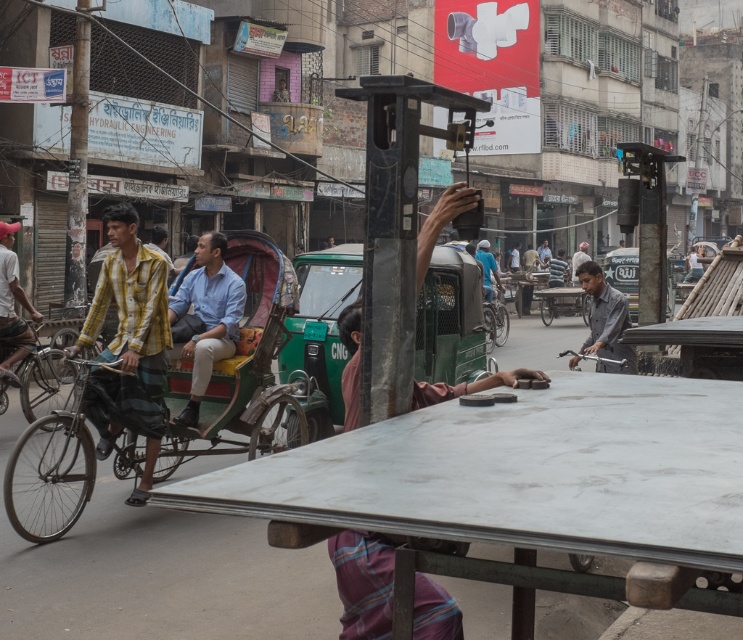
You are standing in the street scene and want to take a photo of both the metal table in the foreground and the green auto rickshaw in the midground. Which point, point 1 at coordinates (265, 321) or point 2 at coordinates (152, 376), is closer to your camera position?

Point 1 at coordinates (265, 321) is further to the camera than point 2 at coordinates (152, 376), so point 2 is closer to your camera position.

You are a pedestrian standing on the street and see both the light blue shirt at center and the gray matte shirt at center. Which one is positioned to the left?

The light blue shirt at center is positioned to the left of the gray matte shirt at center.